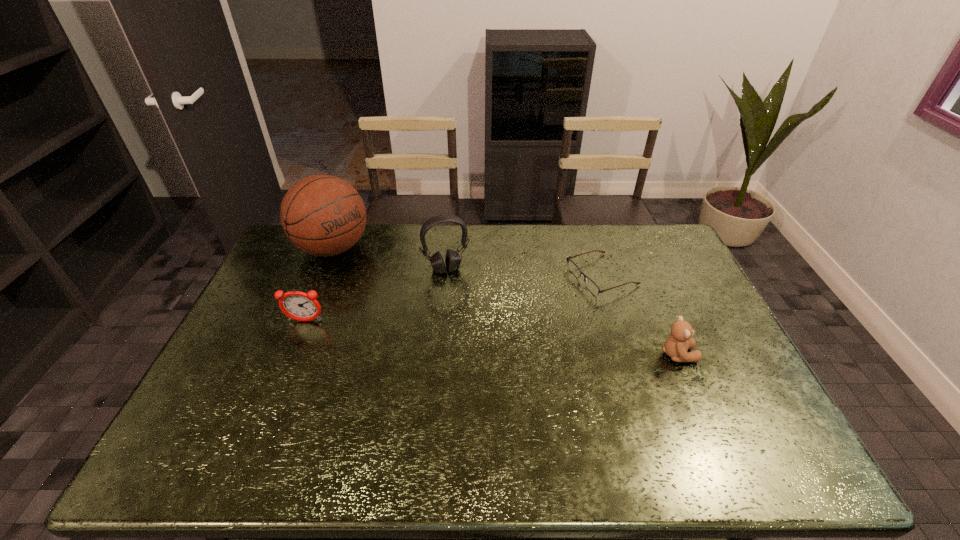
This screenshot has height=540, width=960. What are the coordinates of `free space on the desktop that is between the alarm clock and the teddy bear and is positioned on the front-facing side of the fourth shortest object` in the screenshot? It's located at (468, 336).

Locate an element on the screen. Image resolution: width=960 pixels, height=540 pixels. vacant spot on the desktop that is between the alarm clock and the teddy bear and is positioned on the side with brand label of the tallest object is located at coordinates pyautogui.click(x=453, y=334).

This screenshot has width=960, height=540. Identify the location of vacant space on the desktop that is between the alarm clock and the nearest object and is positioned on the front-facing side of the shortest object. (438, 333).